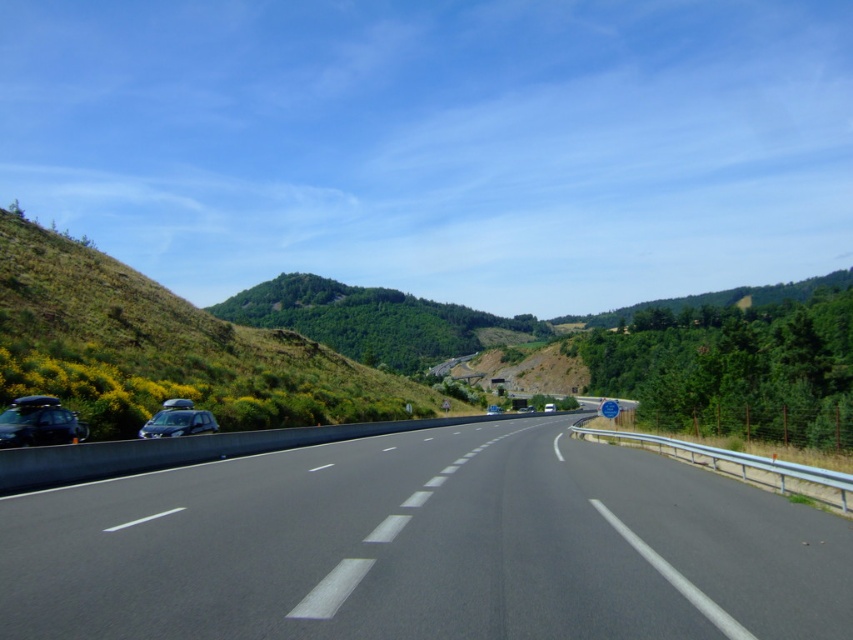
Question: Which is farther from the satin silver car at left?

Choices:
 (A) shiny black car at left
 (B) black asphalt highway at center
 (C) silver metallic van at center

Answer: (C)

Question: Does black asphalt highway at center appear on the left side of shiny black car at left?

Choices:
 (A) no
 (B) yes

Answer: (A)

Question: Which of these objects is positioned farthest from the satin silver car at left?

Choices:
 (A) shiny black car at left
 (B) silver metallic van at center

Answer: (B)

Question: Can you confirm if black asphalt highway at center is thinner than shiny black car at left?

Choices:
 (A) no
 (B) yes

Answer: (A)

Question: Which point is farther to the camera?

Choices:
 (A) (45, 416)
 (B) (283, 620)
 (C) (210, 420)
 (D) (549, 403)

Answer: (D)

Question: Does black asphalt highway at center appear on the left side of silver metallic van at center?

Choices:
 (A) yes
 (B) no

Answer: (A)